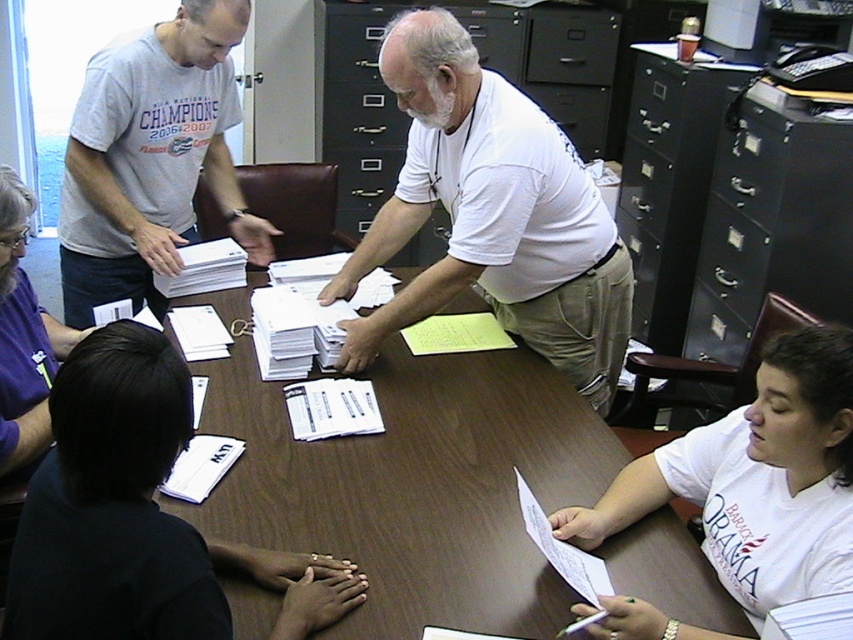
Is white matte shirt at center wider than black matte shirt at lower left?

Yes.

Between point (599, 291) and point (49, 586), which one is positioned in front?

Positioned in front is point (49, 586).

This screenshot has width=853, height=640. Identify the location of white matte shirt at center. (492, 214).

Does gray cotton t-shirt at upper left have a larger size compared to white paper at lower right?

Indeed, gray cotton t-shirt at upper left has a larger size compared to white paper at lower right.

What do you see at coordinates (151, 157) in the screenshot? Image resolution: width=853 pixels, height=640 pixels. I see `gray cotton t-shirt at upper left` at bounding box center [151, 157].

This screenshot has width=853, height=640. I want to click on gray cotton t-shirt at upper left, so click(x=151, y=157).

Consider the image. Does black matte shirt at lower left have a greater height compared to white cotton shirt at lower right?

In fact, black matte shirt at lower left may be shorter than white cotton shirt at lower right.

Is point (213, 544) farther from camera compared to point (785, 406)?

Yes, it is behind point (785, 406).

Where is `black matte shirt at lower left`? The image size is (853, 640). black matte shirt at lower left is located at coordinates (138, 515).